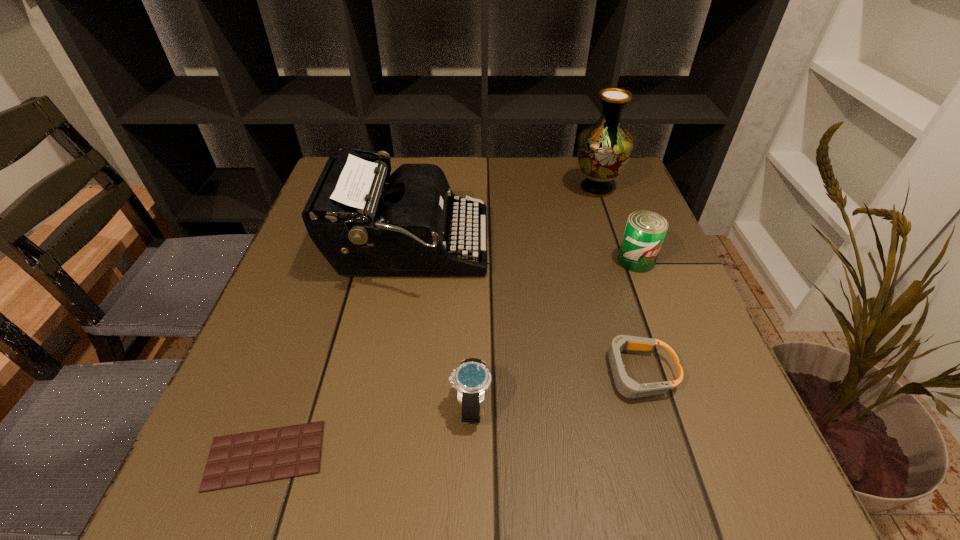
Where is `object that stands as the fifth closest to the fifth tallest object`? object that stands as the fifth closest to the fifth tallest object is located at coordinates [x=604, y=148].

Choose which object is the third nearest neighbor to the vase. Please provide its 2D coordinates. Your answer should be formatted as a tuple, i.e. [(x, y)], where the tuple contains the x and y coordinates of a point satisfying the conditions above.

[(626, 386)]

Locate an element on the screen. The height and width of the screenshot is (540, 960). vacant region that satisfies the following two spatial constraints: 1. on the back side of the farthest object; 2. on the left side of the watch is located at coordinates (474, 188).

Identify the location of free region that satisfies the following two spatial constraints: 1. on the typing side of the typewriter; 2. on the back side of the fourth shortest object. This screenshot has height=540, width=960. (407, 260).

Where is `blank space that satisfies the following two spatial constraints: 1. on the typing side of the watch; 2. on the right side of the typewriter`? blank space that satisfies the following two spatial constraints: 1. on the typing side of the watch; 2. on the right side of the typewriter is located at coordinates (381, 404).

The width and height of the screenshot is (960, 540). I want to click on vacant region that satisfies the following two spatial constraints: 1. on the back side of the third tallest object; 2. on the left side of the chocolate bar, so click(334, 260).

The image size is (960, 540). In order to click on free space that satisfies the following two spatial constraints: 1. on the front and back of the goggles; 2. on the front side of the shortest object in this screenshot , I will do `click(662, 455)`.

Image resolution: width=960 pixels, height=540 pixels. I want to click on vacant region that satisfies the following two spatial constraints: 1. on the typing side of the fifth shortest object; 2. on the left side of the can, so click(x=407, y=260).

In order to click on free point that satisfies the following two spatial constraints: 1. on the front side of the can; 2. on the left side of the tallest object in this screenshot , I will do `click(621, 260)`.